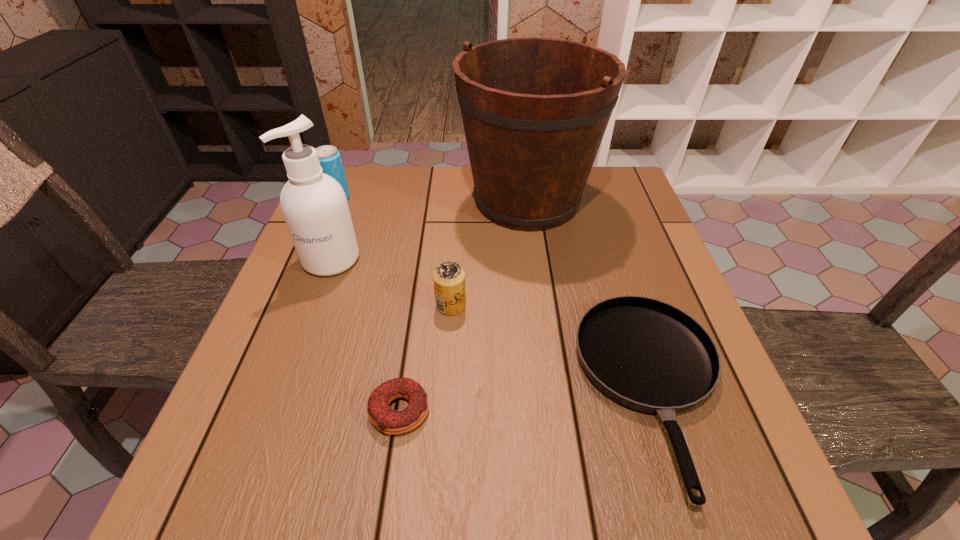
Identify the location of object present at the near right corner. This screenshot has width=960, height=540. (648, 355).

This screenshot has width=960, height=540. In the image, there is a desktop. In order to click on blank space at the far edge in this screenshot , I will do `click(412, 188)`.

The image size is (960, 540). Find the location of `free space at the near edge of the desktop`. free space at the near edge of the desktop is located at coordinates (x=585, y=502).

The width and height of the screenshot is (960, 540). I want to click on blank space at the left edge, so click(257, 363).

At what (x,y) coordinates should I click in order to perform the action: click on free spot at the right edge of the desktop. Please return your answer as a coordinate pair (x, y). Looking at the image, I should click on [658, 263].

The width and height of the screenshot is (960, 540). What are the coordinates of `vacant space at the far left corner of the desktop` in the screenshot? It's located at click(x=363, y=167).

Identify the location of free space at the far right corner of the desktop. This screenshot has height=540, width=960. (589, 177).

What are the coordinates of `free space between the doughnut and the cleansing agent` in the screenshot? It's located at (366, 335).

At what (x,y) coordinates should I click in order to perform the action: click on vacant area that lies between the doughnut and the cleansing agent. Please return your answer as a coordinate pair (x, y). Looking at the image, I should click on (366, 335).

This screenshot has height=540, width=960. What are the coordinates of `empty location between the fourth tallest object and the cleansing agent` in the screenshot? It's located at (391, 282).